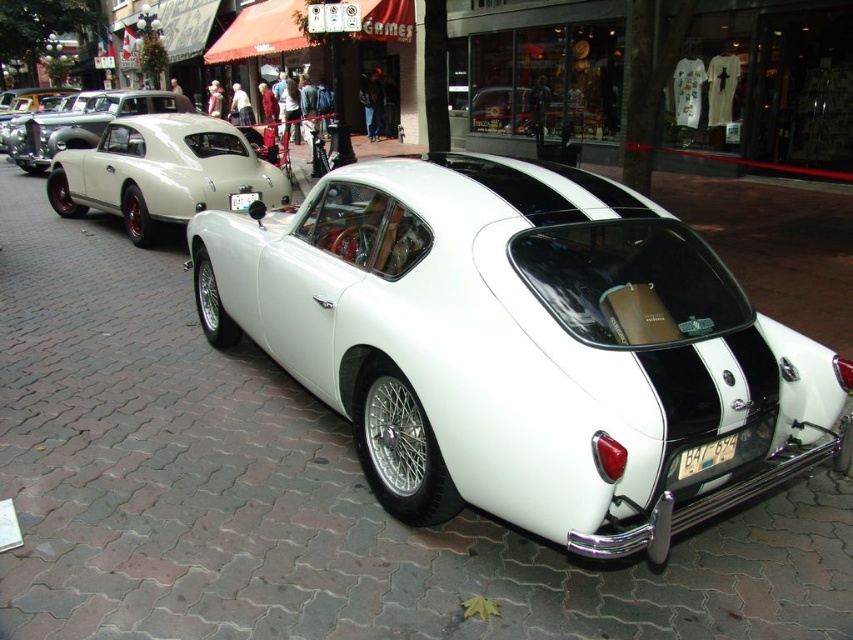
Does white matte sports car at center have a greater height compared to matte white car at left?

Yes, white matte sports car at center is taller than matte white car at left.

Does white matte sports car at center have a smaller size compared to matte white car at left?

No, white matte sports car at center is not smaller than matte white car at left.

Does point (403, 305) lie behind point (73, 216)?

No, (403, 305) is closer to viewer.

Where is `white matte sports car at center`? Image resolution: width=853 pixels, height=640 pixels. white matte sports car at center is located at coordinates [520, 346].

Is white plastic license plate at lower right positioned in front of white plastic license plate at center?

Yes, white plastic license plate at lower right is closer to the viewer.

Does white plastic license plate at lower right come behind white plastic license plate at center?

That is False.

The image size is (853, 640). In order to click on white plastic license plate at lower right in this screenshot , I will do `click(706, 456)`.

At what (x,y) coordinates should I click in order to perform the action: click on white plastic license plate at lower right. Please return your answer as a coordinate pair (x, y). Looking at the image, I should click on (706, 456).

Between white matte sports car at center and white plastic license plate at center, which one is positioned lower?

white matte sports car at center is below.

Is point (635, 456) positioned in front of point (254, 198)?

Yes, it is in front of point (254, 198).

Does point (741, 394) lie behind point (233, 196)?

No, it is not.

Locate an element on the screen. The image size is (853, 640). white matte sports car at center is located at coordinates (520, 346).